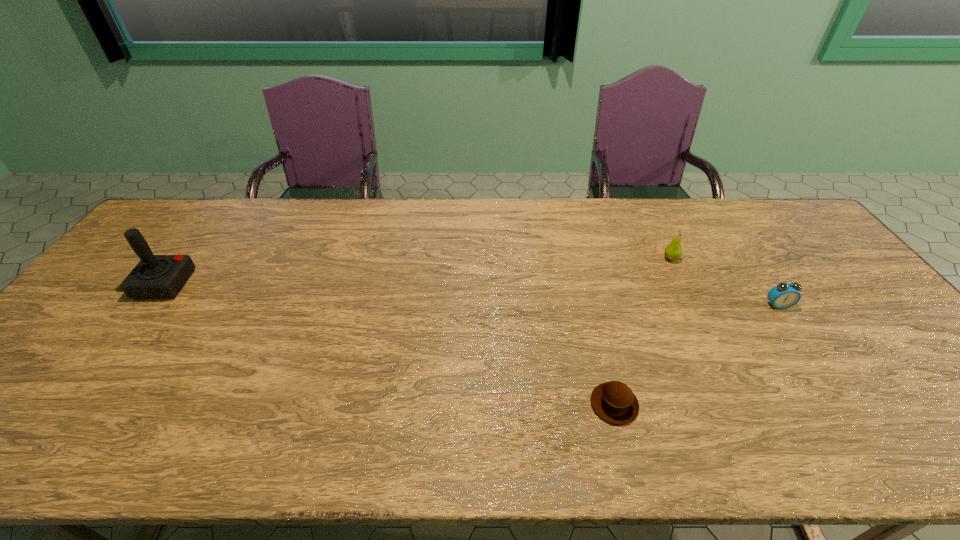
Identify which object is the nearest to the third nearest object. Please provide its 2D coordinates. Your answer should be formatted as a tuple, i.e. [(x, y)], where the tuple contains the x and y coordinates of a point satisfying the conditions above.

[(614, 402)]

In order to click on object that can be found as the closest to the tallest object in this screenshot , I will do `click(614, 402)`.

At what (x,y) coordinates should I click in order to perform the action: click on free location that satisfies the following two spatial constraints: 1. on the base of the nearest object; 2. on the left side of the leftmost object. Please return your answer as a coordinate pair (x, y). This screenshot has width=960, height=540. Looking at the image, I should click on (75, 404).

Locate an element on the screen. The width and height of the screenshot is (960, 540). vacant region that satisfies the following two spatial constraints: 1. on the back side of the third shortest object; 2. on the right side of the muffin is located at coordinates (578, 258).

This screenshot has width=960, height=540. Identify the location of free space that satisfies the following two spatial constraints: 1. on the base of the second farthest object; 2. on the back side of the shortest object. (75, 404).